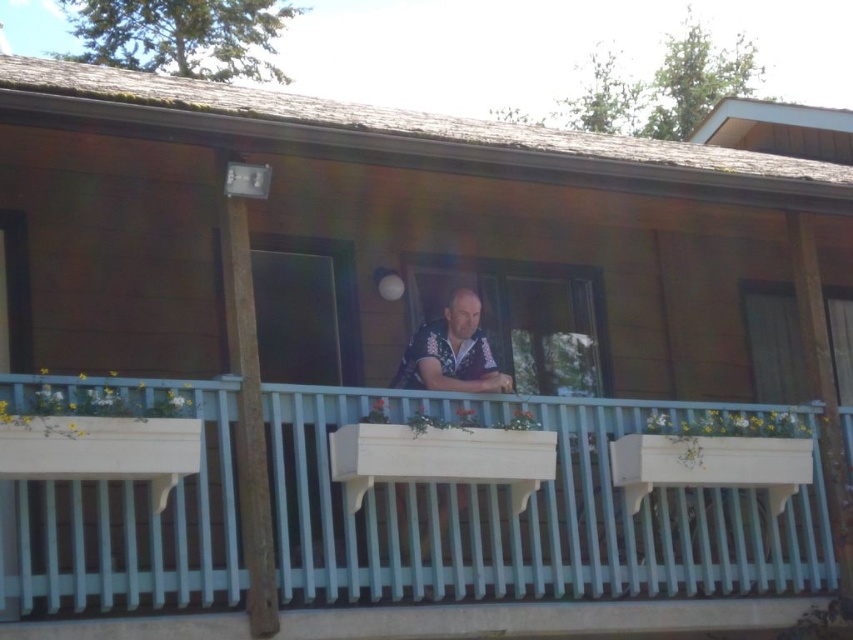
You are standing on the ground floor looking up at the wooden balcony. You notice the white painted wood porch at center and the matte black window at center. Which one is lower in height?

The white painted wood porch at center has a lesser height compared to the matte black window at center, so the white painted wood porch at center is lower in height.

You are standing on the wooden balcony and want to take a photo of both the point at coordinates [518,396] and the point at coordinates [527,352]. Which point should you focus on first to ensure both are in focus?

You should focus on the point at coordinates [527,352] first because it is farther from the camera than the point at coordinates [518,396]. By focusing on the farther point, both points will be in focus due to the depth of field.